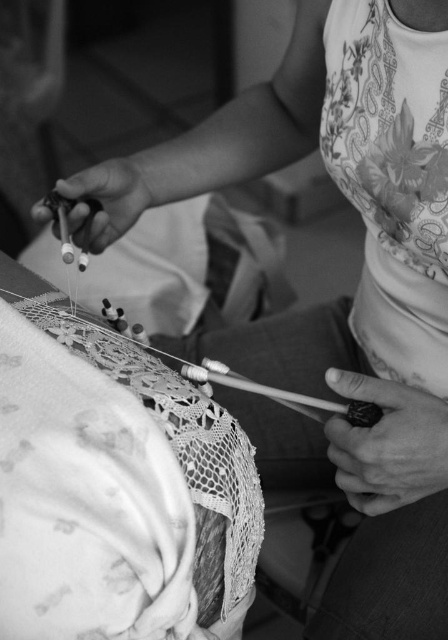
Between lacy white fabric at center and metallic needle at center, which one has more height?

lacy white fabric at center

Who is more forward, (x=52, y=378) or (x=33, y=214)?

Point (x=52, y=378) is more forward.

The image size is (448, 640). I want to click on lacy white fabric at center, so click(116, 490).

Which of these two, smooth black tattoo at lower right or metallic needle at center, stands taller?

Standing taller between the two is metallic needle at center.

This screenshot has width=448, height=640. Find the location of `smooth black tattoo at lower right`. smooth black tattoo at lower right is located at coordinates (387, 444).

Between lacy white fabric at center and smooth black tattoo at lower right, which one is positioned lower?

Positioned lower is smooth black tattoo at lower right.

Does lacy white fabric at center have a larger size compared to smooth black tattoo at lower right?

Correct, lacy white fabric at center is larger in size than smooth black tattoo at lower right.

Find the location of a particular element. lacy white fabric at center is located at coordinates (116, 490).